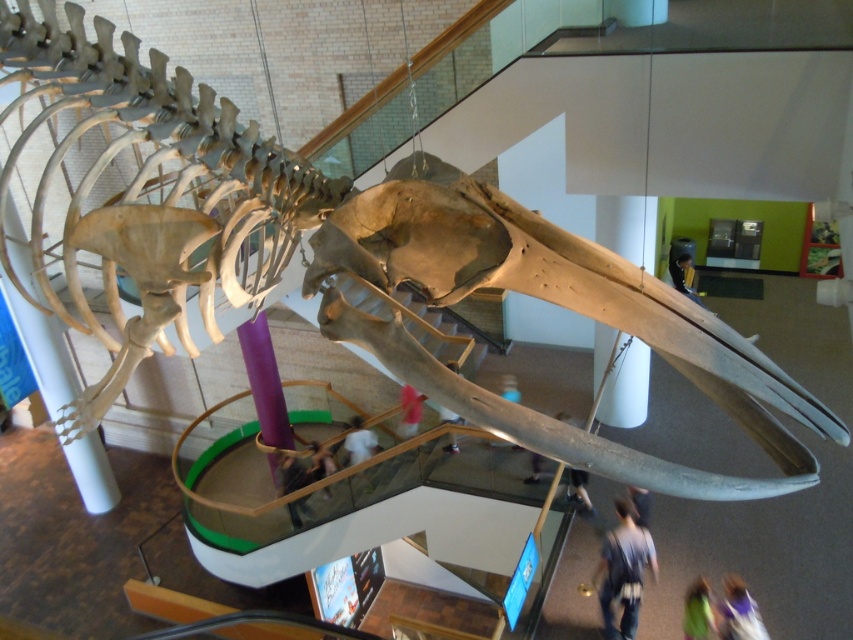
Between point (688, 627) and point (299, 460), which one is positioned in front?

Point (688, 627) is more forward.

In the scene shown: Is green fabric at lower right smaller than light brown leather jacket at lower center?

Actually, green fabric at lower right might be larger than light brown leather jacket at lower center.

Based on the photo, who is more distant from viewer, (x=703, y=618) or (x=306, y=508)?

The point (x=306, y=508) is more distant.

Find the location of `green fabric at lower right`. green fabric at lower right is located at coordinates (698, 611).

Between point (758, 625) and point (283, 492), which one is positioned in front?

Point (758, 625) is in front.

Is purple fabric at lower right bigger than light brown leather jacket at lower center?

Yes.

Locate an element on the screen. This screenshot has width=853, height=640. purple fabric at lower right is located at coordinates (740, 612).

Is point (402, 397) positioned after point (451, 442)?

Yes, point (402, 397) is farther from viewer.

The height and width of the screenshot is (640, 853). In order to click on pink fabric at lower center in this screenshot , I will do `click(409, 410)`.

Is point (404, 419) positioned before point (451, 449)?

No, (404, 419) is further to viewer.

Where is `pink fabric at lower center`? This screenshot has height=640, width=853. pink fabric at lower center is located at coordinates (409, 410).